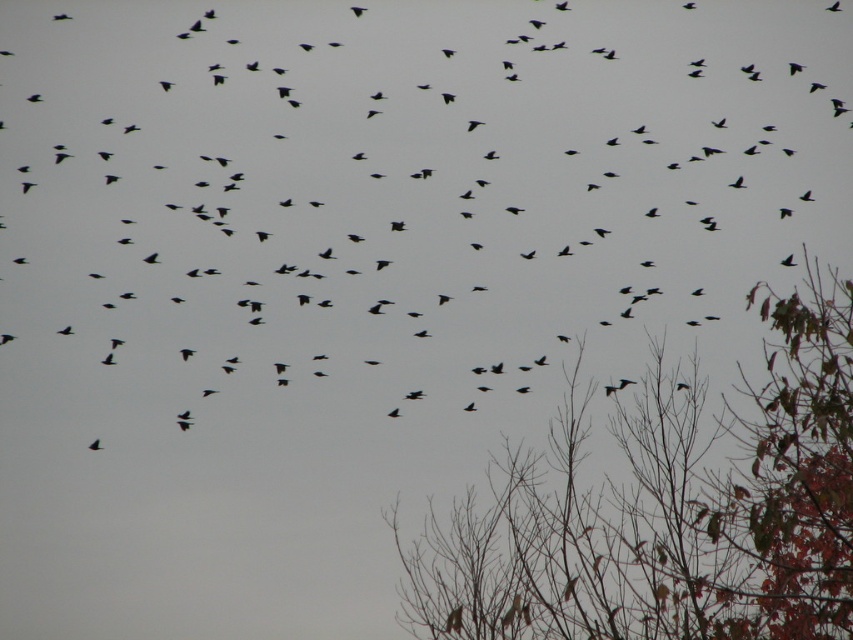
Between black matte birds at center and brown leafy tree at lower right, which one has more height?

black matte birds at center

Is black matte birds at center further to the viewer compared to brown leafy tree at lower right?

Yes.

This screenshot has width=853, height=640. What do you see at coordinates (376, 234) in the screenshot?
I see `black matte birds at center` at bounding box center [376, 234].

This screenshot has height=640, width=853. Identify the location of black matte birds at center. (376, 234).